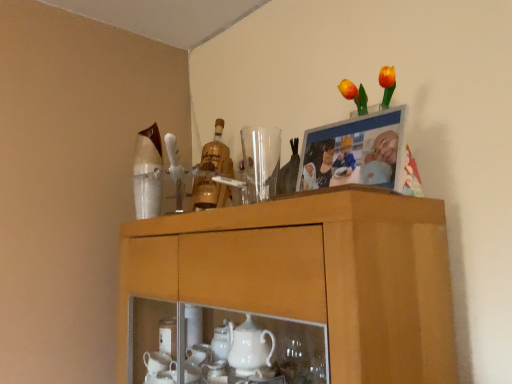
The width and height of the screenshot is (512, 384). In order to click on wooden cabinet at upper center in this screenshot , I will do `click(310, 276)`.

This screenshot has height=384, width=512. Identify the location of transparent glass at upper center. (260, 162).

Which of these two, wooden cabinet at upper center or gold glass bottle at center, is wider?

wooden cabinet at upper center is wider.

Consider the image. Is wooden cabinet at upper center oriented towards gold glass bottle at center?

No, wooden cabinet at upper center does not turn towards gold glass bottle at center.

Can you confirm if wooden cabinet at upper center is smaller than gold glass bottle at center?

Actually, wooden cabinet at upper center might be larger than gold glass bottle at center.

Is wooden cabinet at upper center positioned beyond the bounds of gold glass bottle at center?

That's correct, wooden cabinet at upper center is outside of gold glass bottle at center.

Looking at their sizes, would you say transparent glass at upper center is wider or thinner than gold glass bottle at center?

Clearly, transparent glass at upper center has less width compared to gold glass bottle at center.

Is transparent glass at upper center taller or shorter than gold glass bottle at center?

Clearly, transparent glass at upper center is shorter compared to gold glass bottle at center.

Considering the relative positions of transparent glass at upper center and gold glass bottle at center in the image provided, is transparent glass at upper center to the right of gold glass bottle at center from the viewer's perspective?

Yes.

Is transparent glass at upper center situated inside gold glass bottle at center or outside?

transparent glass at upper center exists outside the volume of gold glass bottle at center.

Is transparent glass at upper center next to wooden cabinet at upper center and touching it?

No.

In order to click on cabinetry that appears below the transparent glass at upper center (from a real-world perspective) in this screenshot , I will do `click(310, 276)`.

Which is behind, transparent glass at upper center or wooden cabinet at upper center?

transparent glass at upper center is more distant.

Does transparent glass at upper center contain wooden cabinet at upper center?

Actually, wooden cabinet at upper center is outside transparent glass at upper center.

Considering the sizes of objects gold glass bottle at center and transparent glass at upper center in the image provided, who is thinner, gold glass bottle at center or transparent glass at upper center?

transparent glass at upper center.

Who is smaller, gold glass bottle at center or transparent glass at upper center?

With smaller size is transparent glass at upper center.

From their relative heights in the image, would you say gold glass bottle at center is taller or shorter than transparent glass at upper center?

Considering their sizes, gold glass bottle at center has more height than transparent glass at upper center.

Which point is more forward, [221,151] or [270,148]?

The point [221,151] is in front.

In terms of size, does wooden cabinet at upper center appear bigger or smaller than transparent glass at upper center?

Considering their sizes, wooden cabinet at upper center takes up more space than transparent glass at upper center.

Is wooden cabinet at upper center positioned with its back to transparent glass at upper center?

No, wooden cabinet at upper center's orientation is not away from transparent glass at upper center.

Considering the sizes of objects wooden cabinet at upper center and transparent glass at upper center in the image provided, who is taller, wooden cabinet at upper center or transparent glass at upper center?

Standing taller between the two is wooden cabinet at upper center.

Which of these two, gold glass bottle at center or wooden cabinet at upper center, is bigger?

Bigger between the two is wooden cabinet at upper center.

Looking at this image, are gold glass bottle at center and wooden cabinet at upper center located far from each other?

gold glass bottle at center is actually quite close to wooden cabinet at upper center.

Is point (215, 164) closer or farther from the camera than point (196, 242)?

Point (215, 164) is farther from the camera than point (196, 242).

In the scene shown: Considering the relative sizes of gold glass bottle at center and wooden cabinet at upper center in the image provided, is gold glass bottle at center thinner than wooden cabinet at upper center?

Yes, gold glass bottle at center is thinner than wooden cabinet at upper center.

Identify the location of bottle that is above the wooden cabinet at upper center (from the image's perspective). The width and height of the screenshot is (512, 384). (217, 154).

Image resolution: width=512 pixels, height=384 pixels. I want to click on bottle located behind the transparent glass at upper center, so click(217, 154).

Based on their spatial positions, is gold glass bottle at center or transparent glass at upper center further from wooden cabinet at upper center?

gold glass bottle at center lies further to wooden cabinet at upper center than the other object.

Considering their positions, is transparent glass at upper center positioned closer to gold glass bottle at center than wooden cabinet at upper center?

transparent glass at upper center is positioned closer to the anchor gold glass bottle at center.

Looking at this image, when comparing their distances from wooden cabinet at upper center, does transparent glass at upper center or gold glass bottle at center seem closer?

transparent glass at upper center is positioned closer to the anchor wooden cabinet at upper center.

Which object lies further to the anchor point gold glass bottle at center, wooden cabinet at upper center or transparent glass at upper center?

wooden cabinet at upper center is positioned further to the anchor gold glass bottle at center.

Estimate the real-world distances between objects in this image. Which object is closer to transparent glass at upper center, gold glass bottle at center or wooden cabinet at upper center?

gold glass bottle at center is positioned closer to the anchor transparent glass at upper center.

Based on their spatial positions, is wooden cabinet at upper center or gold glass bottle at center closer to transparent glass at upper center?

gold glass bottle at center.

Where is `tableware between wooden cabinet at upper center and gold glass bottle at center in the front-back direction`? This screenshot has width=512, height=384. tableware between wooden cabinet at upper center and gold glass bottle at center in the front-back direction is located at coordinates (260, 162).